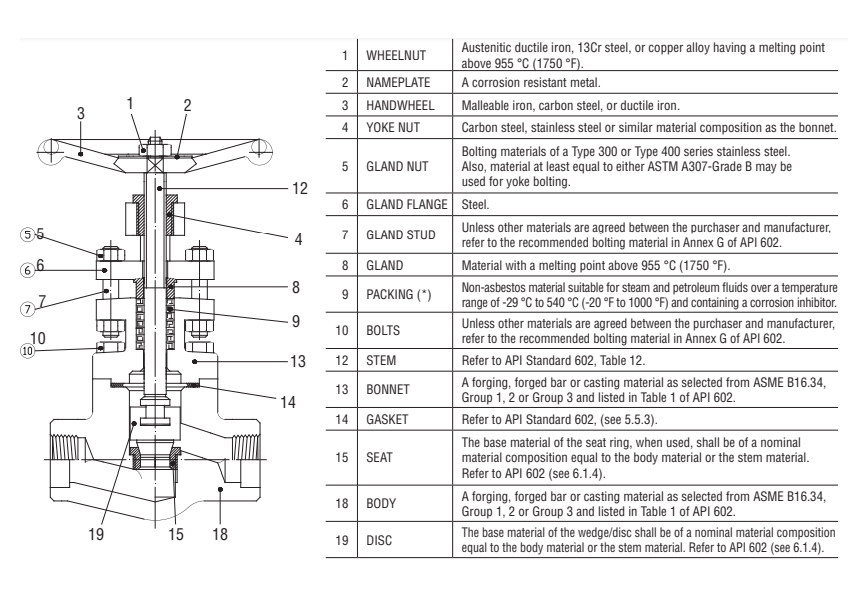
What are the coordinates of `seat on diagram` in the screenshot? It's located at (172, 461), (134, 461).